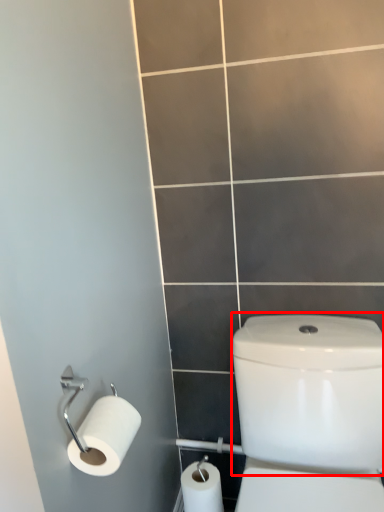
Question: From the image's perspective, what is the correct spatial relationship of water tank (annotated by the red box) in relation to toilet paper?

Choices:
 (A) below
 (B) above

Answer: (A)